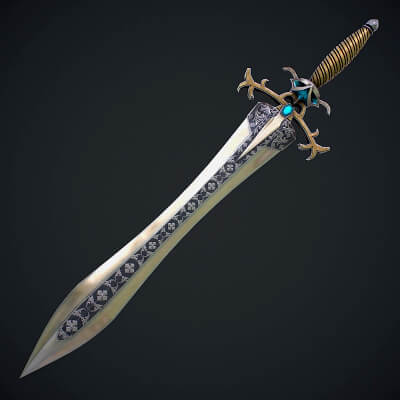
The image size is (400, 400). I want to click on handle, so click(x=337, y=58).